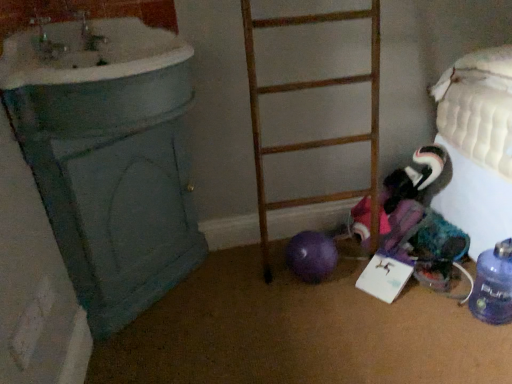
Question: Is wooden ladder at center in front of or behind blue translucent bottle at lower right in the image?

Choices:
 (A) behind
 (B) front

Answer: (B)

Question: Is wooden ladder at center taller or shorter than blue translucent bottle at lower right?

Choices:
 (A) tall
 (B) short

Answer: (A)

Question: Which of these objects is positioned closest to the wooden ladder at center?

Choices:
 (A) blue translucent bottle at lower right
 (B) white glossy sink at upper left

Answer: (B)

Question: Estimate the real-world distances between objects in this image. Which object is farther from the white glossy sink at upper left?

Choices:
 (A) wooden ladder at center
 (B) blue translucent bottle at lower right

Answer: (B)